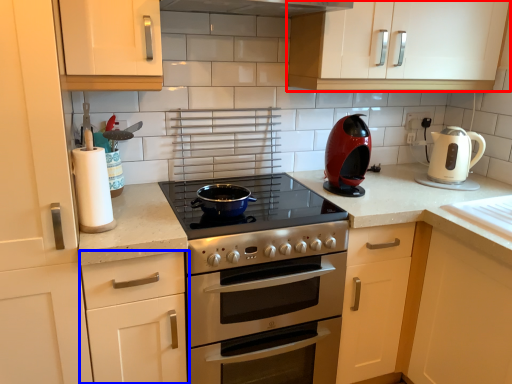
Question: Which of the following is the farthest to the observer, cabinetry (highlighted by a red box) or cabinetry (highlighted by a blue box)?

Choices:
 (A) cabinetry
 (B) cabinetry

Answer: (A)